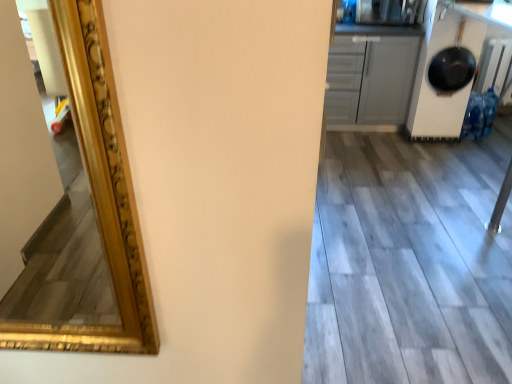
Question: Is wooden floor at lower right inside the boundaries of white matte cabinet at upper right, or outside?

Choices:
 (A) inside
 (B) outside

Answer: (B)

Question: Does point (334, 180) appear closer or farther from the camera than point (367, 77)?

Choices:
 (A) farther
 (B) closer

Answer: (B)

Question: Considering the relative positions of wooden floor at lower right and white matte cabinet at upper right in the image provided, is wooden floor at lower right to the left or to the right of white matte cabinet at upper right?

Choices:
 (A) right
 (B) left

Answer: (A)

Question: Is white matte cabinet at upper right wider or thinner than wooden floor at lower right?

Choices:
 (A) wide
 (B) thin

Answer: (B)

Question: Considering the relative positions of white matte cabinet at upper right and wooden floor at lower right in the image provided, is white matte cabinet at upper right to the left or to the right of wooden floor at lower right?

Choices:
 (A) right
 (B) left

Answer: (B)

Question: Is white matte cabinet at upper right in front of or behind wooden floor at lower right in the image?

Choices:
 (A) behind
 (B) front

Answer: (A)

Question: Is white matte cabinet at upper right inside the boundaries of wooden floor at lower right, or outside?

Choices:
 (A) outside
 (B) inside

Answer: (A)